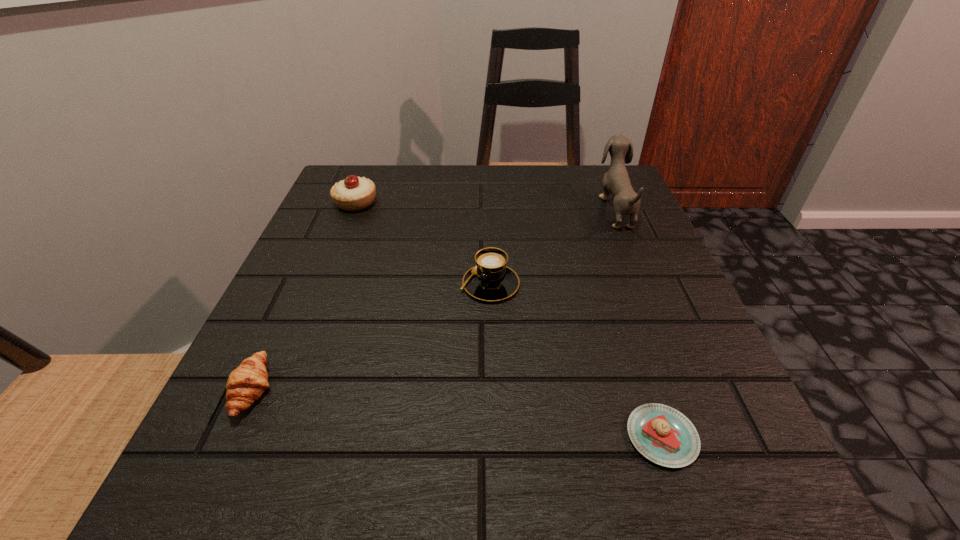
Identify the location of object that can be found as the second closest to the third farthest object. This screenshot has height=540, width=960. tap(662, 434).

Identify the location of the fourth closest object to the shortest object. The width and height of the screenshot is (960, 540). (354, 193).

Where is `the third closest pastry to the puppy`? The image size is (960, 540). the third closest pastry to the puppy is located at coordinates (245, 384).

At what (x,y) coordinates should I click in order to perform the action: click on pastry identified as the third closest to the tallest object. Please return your answer as a coordinate pair (x, y). The height and width of the screenshot is (540, 960). Looking at the image, I should click on click(245, 384).

Locate an element on the screen. free space that satisfies the following two spatial constraints: 1. on the front-facing side of the second shortest pastry; 2. on the right side of the rightmost pastry is located at coordinates (231, 437).

What are the coordinates of `vacant space that satisfies the following two spatial constraints: 1. on the front-facing side of the shortest object; 2. on the left side of the second tallest pastry` in the screenshot? It's located at (231, 437).

The width and height of the screenshot is (960, 540). Find the location of `free space that satisfies the following two spatial constraints: 1. on the front side of the tallest pastry; 2. on the right side of the rightmost pastry`. free space that satisfies the following two spatial constraints: 1. on the front side of the tallest pastry; 2. on the right side of the rightmost pastry is located at coordinates (262, 437).

Find the location of a particular element. vacant region that satisfies the following two spatial constraints: 1. on the front side of the tallest pastry; 2. on the left side of the rightmost pastry is located at coordinates (262, 437).